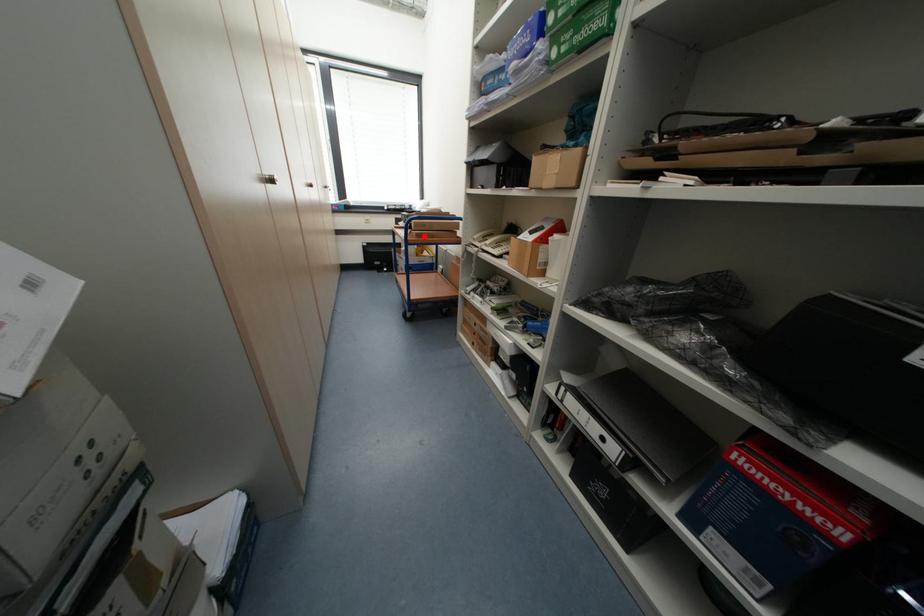
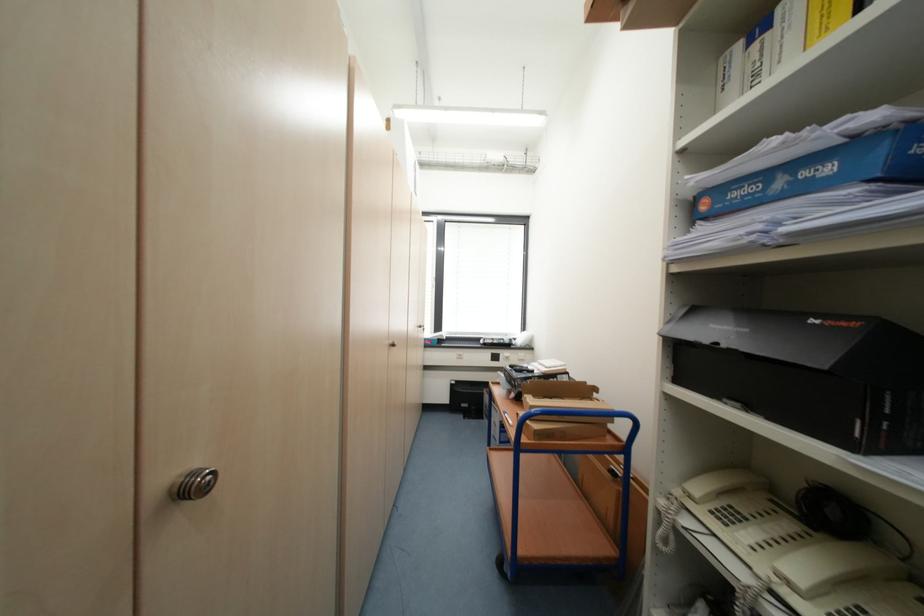
Question: I am providing you with two images of the same scene from different viewpoints. Given a red point in image1, look at the same physical point in image2. Is it:

Choices:
 (A) Closer to the viewpoint
 (B) Farther from the viewpoint

Answer: (B)